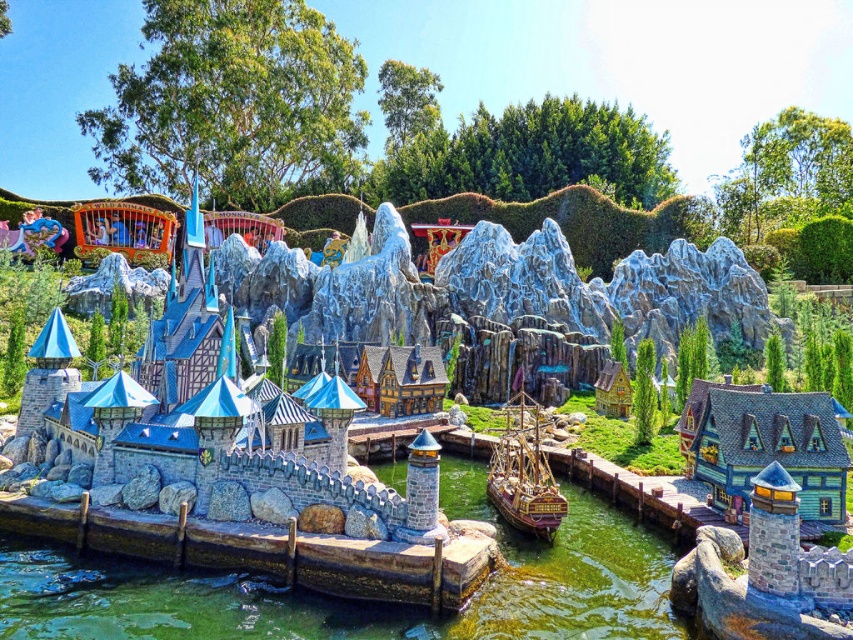
Is wooden house at right behind wooden ship at lower center?

No, wooden house at right is closer to the viewer.

The height and width of the screenshot is (640, 853). I want to click on wooden house at right, so click(764, 444).

Locate an element on the screen. This screenshot has width=853, height=640. wooden house at right is located at coordinates (x=764, y=444).

Is clear glass water at center bigger than wooden house at right?

Indeed, clear glass water at center has a larger size compared to wooden house at right.

Who is more distant from viewer, (462, 467) or (735, 458)?

Point (462, 467)

Identify the location of clear glass water at center. (366, 602).

The height and width of the screenshot is (640, 853). I want to click on clear glass water at center, so click(366, 602).

Is clear glass water at center taller than wooden ship at lower center?

No.

Can you confirm if clear glass water at center is positioned to the left of wooden ship at lower center?

Yes, clear glass water at center is to the left of wooden ship at lower center.

Is point (589, 492) behind point (529, 522)?

Yes, point (589, 492) is farther from viewer.

Find the location of a particular element. This screenshot has height=640, width=853. clear glass water at center is located at coordinates (366, 602).